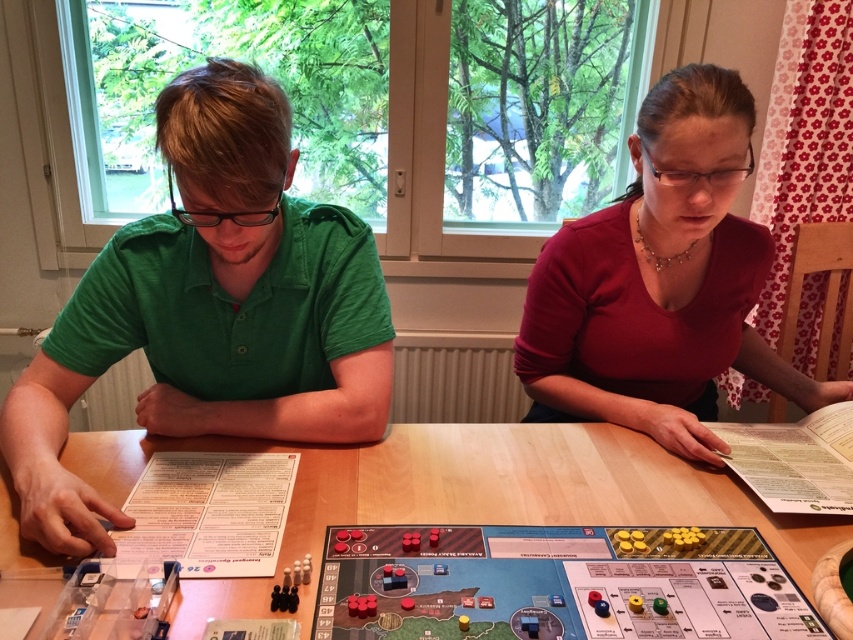
Question: Which point is farther from the camera taking this photo?

Choices:
 (A) (605, 451)
 (B) (691, 152)

Answer: (A)

Question: Estimate the real-world distances between objects in this image. Which object is farther from the green cotton shirt at left?

Choices:
 (A) wooden table at center
 (B) wooden board game at center
 (C) matte red shirt at center

Answer: (C)

Question: Can you confirm if green cotton shirt at left is smaller than matte red shirt at center?

Choices:
 (A) no
 (B) yes

Answer: (B)

Question: Can you confirm if matte red shirt at center is positioned to the right of wooden table at center?

Choices:
 (A) yes
 (B) no

Answer: (A)

Question: Based on their relative distances, which object is farther from the matte red shirt at center?

Choices:
 (A) wooden board game at center
 (B) green cotton shirt at left
 (C) wooden table at center

Answer: (B)

Question: Does matte red shirt at center appear on the left side of wooden table at center?

Choices:
 (A) yes
 (B) no

Answer: (B)